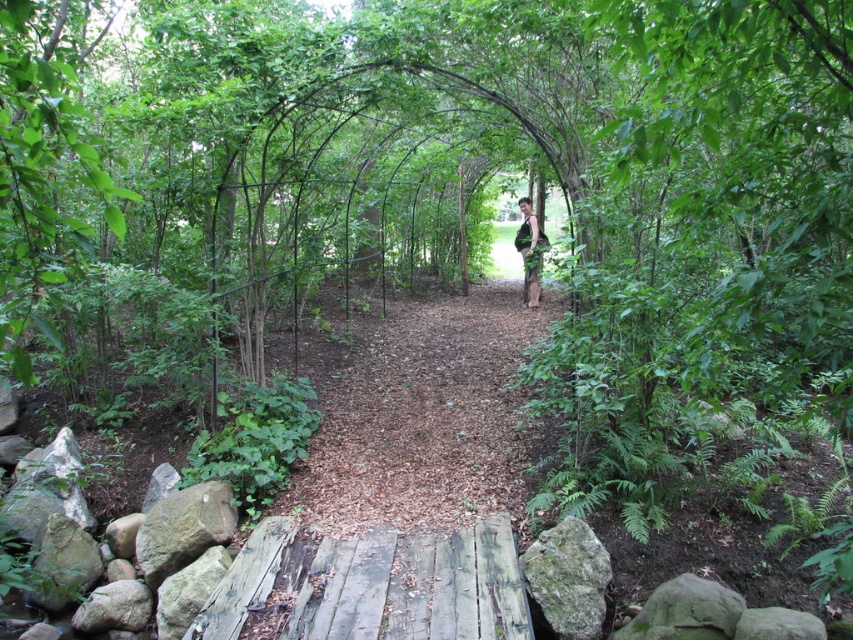
Question: Can you confirm if weathered wooden bridge at lower center is positioned above green fabric pants at center?

Choices:
 (A) yes
 (B) no

Answer: (B)

Question: Considering the real-world distances, which object is farthest from the green fabric pants at center?

Choices:
 (A) wooden planks at center
 (B) weathered wooden bridge at lower center

Answer: (B)

Question: Which point is closer to the camera taking this photo?

Choices:
 (A) (430, 548)
 (B) (543, 248)

Answer: (A)

Question: Can you confirm if wooden planks at center is smaller than green fabric pants at center?

Choices:
 (A) no
 (B) yes

Answer: (A)

Question: Does wooden planks at center come in front of green fabric pants at center?

Choices:
 (A) yes
 (B) no

Answer: (A)

Question: Considering the real-world distances, which object is closest to the green fabric pants at center?

Choices:
 (A) wooden planks at center
 (B) weathered wooden bridge at lower center

Answer: (A)